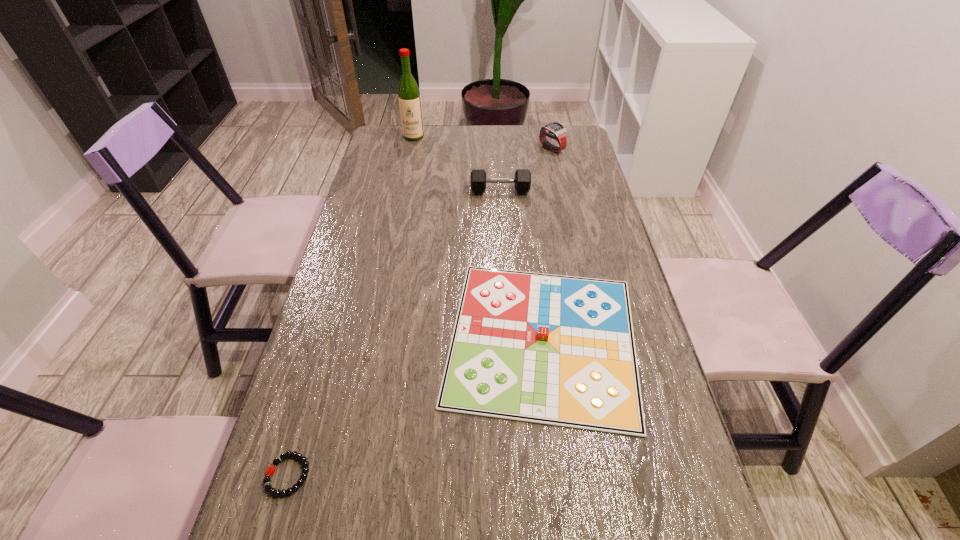
Find the location of a particular element. The image size is (960, 540). vacant area that lies between the dumbbell and the bracelet is located at coordinates 395,333.

You are a GUI agent. You are given a task and a screenshot of the screen. Output one action in this format:
    pyautogui.click(x=<x>, y=<y>)
    Task: Click on the closest object relative to the watch
    
    Given the screenshot: What is the action you would take?
    pyautogui.click(x=522, y=181)

Select which object is the closest to the watch. Please provide its 2D coordinates. Your answer should be formatted as a tuple, i.e. [(x, y)], where the tuple contains the x and y coordinates of a point satisfying the conditions above.

[(522, 181)]

The height and width of the screenshot is (540, 960). Identify the location of free space that satisfies the following two spatial constraints: 1. on the back side of the watch; 2. on the left side of the dumbbell. (498, 149).

Find the location of a particular element. This screenshot has height=540, width=960. free region that satisfies the following two spatial constraints: 1. on the label of the liquor; 2. on the right side of the fourth tallest object is located at coordinates (372, 339).